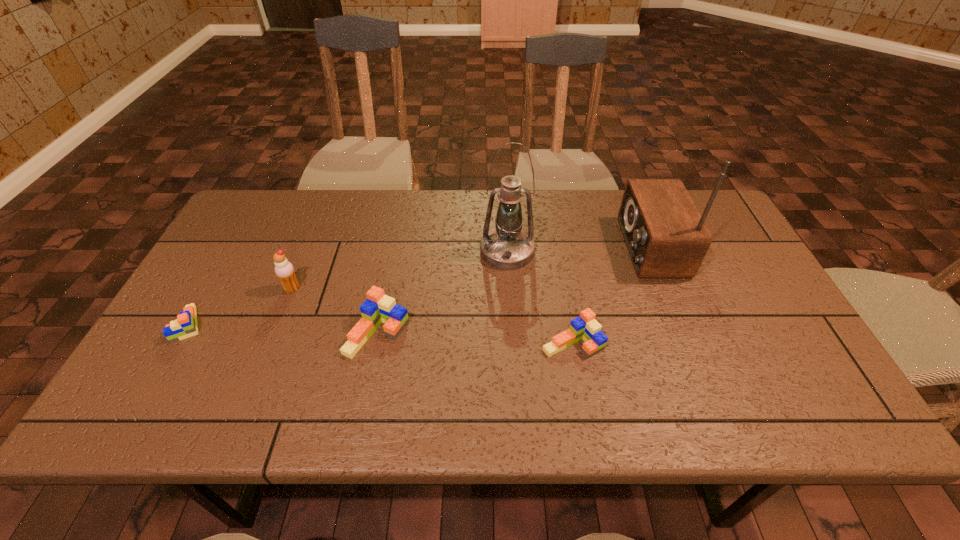
What are the coordinates of `object that is at the left edge` in the screenshot? It's located at (185, 325).

The height and width of the screenshot is (540, 960). I want to click on blank area at the far edge, so click(349, 204).

At what (x,y) coordinates should I click in order to perform the action: click on vacant area at the near edge of the desktop. Please return your answer as a coordinate pair (x, y). The height and width of the screenshot is (540, 960). Looking at the image, I should click on (392, 366).

The image size is (960, 540). I want to click on free space at the left edge of the desktop, so click(x=243, y=264).

Where is `free point at the right edge`? This screenshot has width=960, height=540. free point at the right edge is located at coordinates (799, 342).

The width and height of the screenshot is (960, 540). Find the location of `vacant region at the far left corner of the desktop`. vacant region at the far left corner of the desktop is located at coordinates (273, 220).

Identify the location of vacant region at the far right corner. The width and height of the screenshot is (960, 540). (719, 228).

The height and width of the screenshot is (540, 960). I want to click on free location at the near right corner, so click(x=760, y=375).

Find the location of `free space between the fourth object from right to left and the leftmost Lego`. free space between the fourth object from right to left and the leftmost Lego is located at coordinates (283, 329).

Find the location of a particular element. vacant space in between the rightmost Lego and the fourth object from right to left is located at coordinates (475, 338).